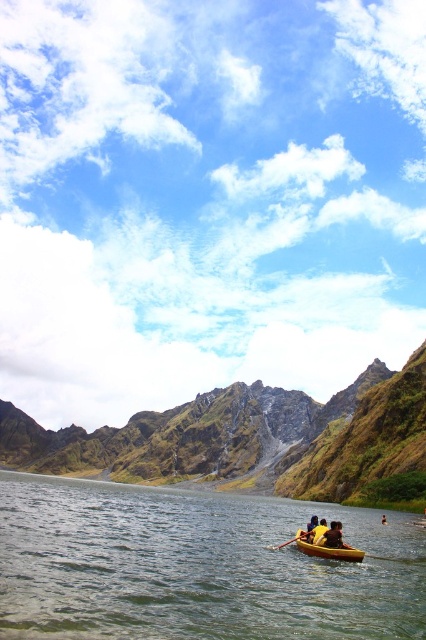
Question: Which of the following is the farthest from the observer?

Choices:
 (A) clear water at center
 (B) yellow fabric person at center
 (C) yellow wood paddle at center

Answer: (B)

Question: Which of the following is the closest to the observer?

Choices:
 (A) yellow matte boat at lower center
 (B) yellow fabric person at center

Answer: (A)

Question: Can you confirm if yellow wood paddle at center is positioned to the right of yellow fabric person at center?

Choices:
 (A) no
 (B) yes

Answer: (A)

Question: Which point appears farthest from the camera in this image?

Choices:
 (A) (382, 515)
 (B) (331, 554)
 (C) (299, 534)

Answer: (A)

Question: Is clear water at center smaller than yellow matte boat at lower center?

Choices:
 (A) yes
 (B) no

Answer: (B)

Question: Where is rugged rock mountain at center located in relation to yellow plastic boat at center in the image?

Choices:
 (A) below
 (B) above

Answer: (A)